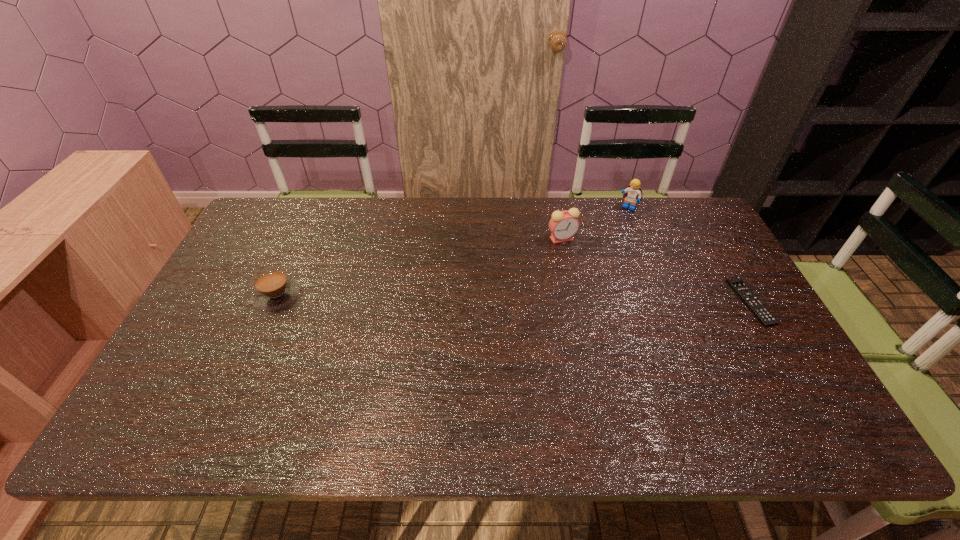
Locate an element on the screen. vacant region between the farthest object and the shortest object is located at coordinates (689, 254).

The width and height of the screenshot is (960, 540). I want to click on free space between the remote control and the third object from left to right, so click(689, 254).

Where is `unoccupied area between the third object from right to left and the third tallest object`? The image size is (960, 540). unoccupied area between the third object from right to left and the third tallest object is located at coordinates (420, 267).

At what (x,y) coordinates should I click in order to perform the action: click on empty space between the farthest object and the alarm clock. Please return your answer as a coordinate pair (x, y). This screenshot has width=960, height=540. Looking at the image, I should click on (594, 223).

Find the location of `blank region between the alarm clock and the third object from left to right`. blank region between the alarm clock and the third object from left to right is located at coordinates (594, 223).

The height and width of the screenshot is (540, 960). What are the coordinates of `unoccupied position between the cappuccino and the Lego` in the screenshot? It's located at (452, 251).

This screenshot has width=960, height=540. In order to click on object that is the closest to the cappuccino in this screenshot , I will do `click(563, 225)`.

Identify the location of object that stands as the second closest to the remote control. pos(563,225).

Locate an element on the screen. This screenshot has height=540, width=960. vacant space that satisfies the following two spatial constraints: 1. on the back side of the alarm clock; 2. on the left side of the leftmost object is located at coordinates (302, 238).

The image size is (960, 540). I want to click on vacant space that satisfies the following two spatial constraints: 1. on the front side of the rightmost object; 2. on the left side of the third tallest object, so click(275, 301).